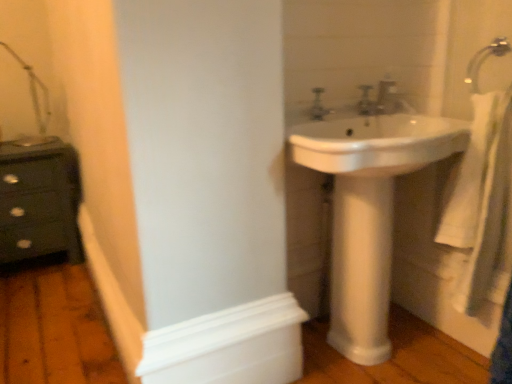
Where is `white glossy pedestal at center`? This screenshot has height=384, width=512. white glossy pedestal at center is located at coordinates (361, 266).

Find the location of a particular element. This screenshot has width=512, height=384. white cotton bath towel at right is located at coordinates (482, 201).

Measure the distance between silver metallic faucet at upper right and camera.

silver metallic faucet at upper right is 3.96 feet from camera.

Identify the location of dark green wooden chest of drawers at left. (39, 202).

You are a GUI agent. You are given a task and a screenshot of the screen. Output one action in this format:
    pyautogui.click(x=<x>, y=<y>)
    Task: Click on the matte silver faucet at upper center, the 1th plumbing fixture viewed from the left
    This screenshot has width=512, height=384.
    Given the screenshot: What is the action you would take?
    pyautogui.click(x=365, y=101)

Describe the element at coordinates (376, 143) in the screenshot. I see `white glossy sink at center` at that location.

Where is `white glossy pedestal at center`? white glossy pedestal at center is located at coordinates (361, 266).

Considering the relative sizes of matte silver faucet at upper center, the 1th plumbing fixture viewed from the left, and silver metallic faucet at upper right in the image provided, is matte silver faucet at upper center, the 1th plumbing fixture viewed from the left, bigger than silver metallic faucet at upper right?

No.

Considering the relative sizes of matte silver faucet at upper center, the 2th plumbing fixture viewed from the right, and silver metallic faucet at upper right in the image provided, is matte silver faucet at upper center, the 2th plumbing fixture viewed from the right, thinner than silver metallic faucet at upper right?

No.

This screenshot has height=384, width=512. I want to click on tap located in front of the matte silver faucet at upper center, the 1th plumbing fixture viewed from the left, so click(318, 105).

From the image's perspective, is white glossy sink at center above or below silver metallic faucet at upper right?

white glossy sink at center is situated lower than silver metallic faucet at upper right in the image.

Is white glossy sink at center in contact with silver metallic faucet at upper right?

No, white glossy sink at center is not in contact with silver metallic faucet at upper right.

Does point (464, 123) come in front of point (503, 50)?

No.

Where is `sink located underneath the silver metallic faucet at upper right (from a real-world perspective)`? This screenshot has width=512, height=384. sink located underneath the silver metallic faucet at upper right (from a real-world perspective) is located at coordinates (376, 143).

Considering the relative sizes of white glossy sink at center and silver metallic faucet at upper right in the image provided, is white glossy sink at center taller than silver metallic faucet at upper right?

Correct, white glossy sink at center is much taller as silver metallic faucet at upper right.

The image size is (512, 384). Find the location of `sink lying in front of the silver metallic faucet at upper right`. sink lying in front of the silver metallic faucet at upper right is located at coordinates (376, 143).

Is white glossy sink at center positioned far away from silver metallic faucet at upper right?

No, white glossy sink at center is not far away from silver metallic faucet at upper right.

Based on the photo, could you tell me if satin nickel faucet at upper right, placed as the second plumbing fixture when sorted from left to right, is turned towards white glossy sink at center?

No.

In the scene shown: Who is taller, satin nickel faucet at upper right, placed as the second plumbing fixture when sorted from left to right, or white glossy sink at center?

white glossy sink at center is taller.

Is satin nickel faucet at upper right, placed as the first plumbing fixture when sorted from right to left, far away from white glossy sink at center?

That's not correct — satin nickel faucet at upper right, placed as the first plumbing fixture when sorted from right to left, is a little close to white glossy sink at center.

Which of these two, satin nickel faucet at upper right, placed as the second plumbing fixture when sorted from left to right, or white glossy sink at center, is smaller?

Smaller between the two is satin nickel faucet at upper right, placed as the second plumbing fixture when sorted from left to right.

Is white glossy pedestal at center completely or partially inside silver metallic faucet at upper right?

Definitely not — white glossy pedestal at center is not inside silver metallic faucet at upper right.

Visually, is silver metallic faucet at upper right positioned to the left or to the right of white glossy pedestal at center?

silver metallic faucet at upper right is positioned on white glossy pedestal at center's left side.

Is point (317, 109) closer or farther from the camera than point (378, 269)?

Point (317, 109) is positioned farther from the camera compared to point (378, 269).

Is silver metallic faucet at upper right facing towards white glossy pedestal at center?

No, silver metallic faucet at upper right is not aimed at white glossy pedestal at center.

Does silver metallic faucet at upper right have a greater width compared to dark green wooden chest of drawers at left?

In fact, silver metallic faucet at upper right might be narrower than dark green wooden chest of drawers at left.

Is silver metallic faucet at upper right aimed at dark green wooden chest of drawers at left?

No, silver metallic faucet at upper right is not facing towards dark green wooden chest of drawers at left.

This screenshot has width=512, height=384. I want to click on chest of drawers below the silver metallic faucet at upper right (from a real-world perspective), so click(x=39, y=202).

Is point (310, 111) closer to viewer compared to point (36, 206)?

Yes, point (310, 111) is closer to viewer.

Does white cotton bath towel at right have a greater height compared to white glossy pedestal at center?

Yes, white cotton bath towel at right is taller than white glossy pedestal at center.

Consider the image. Is white cotton bath towel at right with white glossy pedestal at center?

No, white cotton bath towel at right is not in contact with white glossy pedestal at center.

Is white cotton bath towel at right further to the viewer compared to white glossy pedestal at center?

No, white cotton bath towel at right is closer to the viewer.

Can you confirm if white cotton bath towel at right is positioned to the right of white glossy pedestal at center?

Correct, you'll find white cotton bath towel at right to the right of white glossy pedestal at center.

Locate an element on the screen. tap below the matte silver faucet at upper center, the 1th plumbing fixture viewed from the left (from the image's perspective) is located at coordinates (318, 105).

Locate an element on the screen. The width and height of the screenshot is (512, 384). shower behind the white glossy sink at center is located at coordinates (485, 59).

Estimate the real-world distances between objects in this image. Which object is closer to dark green wooden chest of drawers at left, silver metallic faucet at upper right or satin nickel faucet at upper right, placed as the first plumbing fixture when sorted from right to left?

Among the two, silver metallic faucet at upper right is located nearer to dark green wooden chest of drawers at left.

Looking at the image, which one is located closer to silver metallic faucet at upper right, white glossy sink at center or white matte molding at lower left?

white glossy sink at center is positioned closer to the anchor silver metallic faucet at upper right.

When comparing their distances from silver metallic faucet at upper right, does silver metallic faucet at upper right or white cotton bath towel at right seem closer?

white cotton bath towel at right lies closer to silver metallic faucet at upper right than the other object.

Estimate the real-world distances between objects in this image. Which object is further from silver metallic faucet at upper right, dark green wooden chest of drawers at left or silver metallic faucet at upper right?

The object further to silver metallic faucet at upper right is dark green wooden chest of drawers at left.

Estimate the real-world distances between objects in this image. Which object is further from white matte molding at lower left, white glossy pedestal at center or white cotton bath towel at right?

white cotton bath towel at right.

Based on their spatial positions, is satin nickel faucet at upper right, placed as the second plumbing fixture when sorted from left to right, or white cotton bath towel at right further from white glossy pedestal at center?

Based on the image, satin nickel faucet at upper right, placed as the second plumbing fixture when sorted from left to right, appears to be further to white glossy pedestal at center.

From the image, which object appears to be farther from matte silver faucet at upper center, the 2th plumbing fixture viewed from the right, satin nickel faucet at upper right, placed as the second plumbing fixture when sorted from left to right, or dark green wooden chest of drawers at left?

The object further to matte silver faucet at upper center, the 2th plumbing fixture viewed from the right, is dark green wooden chest of drawers at left.

From the image, which object appears to be farther from dark green wooden chest of drawers at left, white cotton bath towel at right or white glossy pedestal at center?

white cotton bath towel at right is positioned further to the anchor dark green wooden chest of drawers at left.

Image resolution: width=512 pixels, height=384 pixels. I want to click on sink that lies between matte silver faucet at upper center, the 1th plumbing fixture viewed from the left, and white glossy pedestal at center from top to bottom, so click(x=376, y=143).

This screenshot has height=384, width=512. I want to click on bath towel between silver metallic faucet at upper right and white glossy pedestal at center in the up-down direction, so click(482, 201).

Image resolution: width=512 pixels, height=384 pixels. In order to click on bath towel positioned between white glossy sink at center and satin nickel faucet at upper right, placed as the second plumbing fixture when sorted from left to right, from near to far in this screenshot , I will do `click(482, 201)`.

Find the location of `bath towel that lies between satin nickel faucet at upper right, placed as the first plumbing fixture when sorted from right to left, and white glossy pedestal at center from top to bottom`. bath towel that lies between satin nickel faucet at upper right, placed as the first plumbing fixture when sorted from right to left, and white glossy pedestal at center from top to bottom is located at coordinates (482, 201).